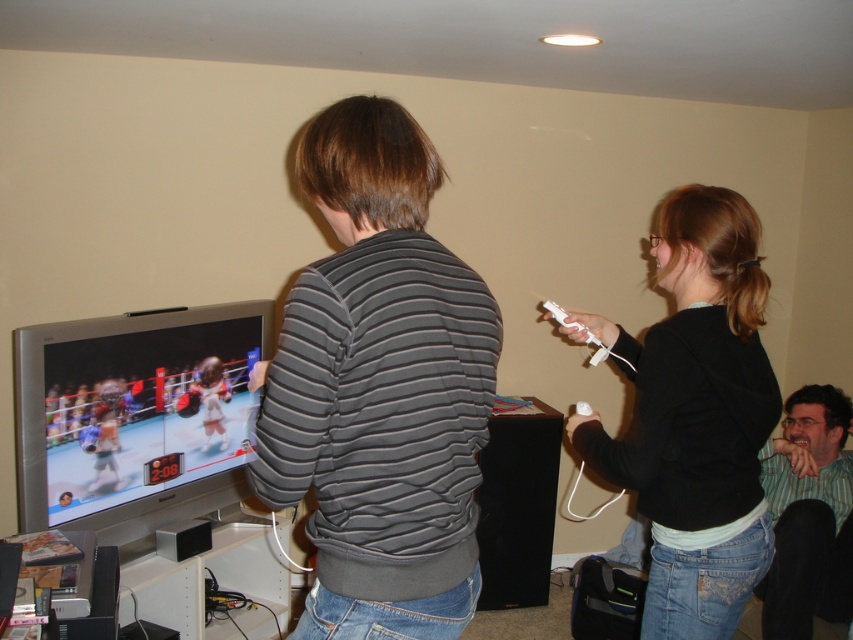
Question: Does black knit sweater at upper right appear under green striped shirt at lower right?

Choices:
 (A) no
 (B) yes

Answer: (A)

Question: Which point is closer to the camera?

Choices:
 (A) black knit sweater at upper right
 (B) striped cotton shirt at center
 (C) white matte game controller at right
 (D) green striped shirt at lower right

Answer: (B)

Question: Based on their relative distances, which object is nearer to the striped cotton shirt at center?

Choices:
 (A) black knit sweater at upper right
 (B) dark gray striped sweater at center
 (C) green striped shirt at lower right

Answer: (B)

Question: Does striped cotton shirt at center have a greater width compared to black knit sweater at upper right?

Choices:
 (A) no
 (B) yes

Answer: (B)

Question: Which point is farther from the camera taking this photo?

Choices:
 (A) (688, 381)
 (B) (308, 632)

Answer: (A)

Question: Considering the relative positions of striped cotton shirt at center and black knit sweater at upper right in the image provided, where is striped cotton shirt at center located with respect to black knit sweater at upper right?

Choices:
 (A) right
 (B) left

Answer: (B)